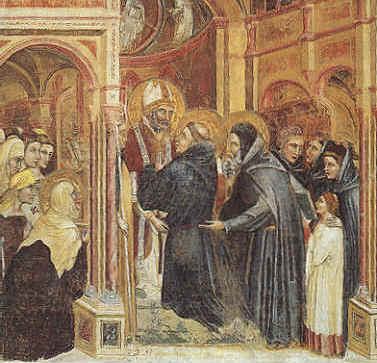
Find the location of a particular element. This screenshot has height=363, width=377. floor is located at coordinates (225, 355).